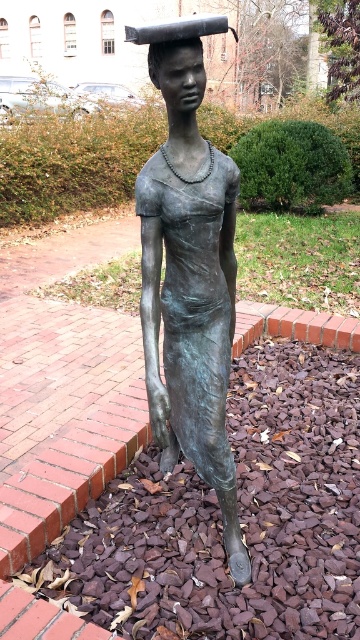
You are a photographer trying to capture the bronze statue at center and the bronze statue head at upper center in a single shot. Which part of the statue will appear larger in your photo?

The bronze statue at center will appear larger in the photo because it is closer to the viewer than the bronze statue head at upper center.

You are an art student analyzing the statue. You notice the bronze statue at center and the bronze statue head at upper center. Which part of the statue is bigger in size?

The bronze statue at center has a larger size compared to the bronze statue head at upper center.